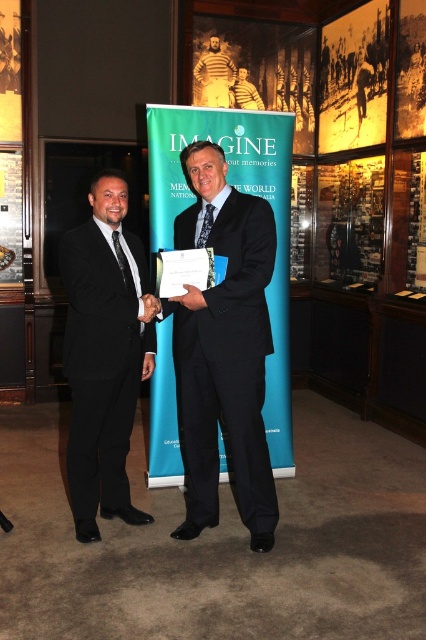
Does black suit at left have a smaller size compared to striped knit sweater at center?

No, black suit at left is not smaller than striped knit sweater at center.

Is the position of black suit at left less distant than that of striped knit sweater at center?

Yes.

Which is in front, point (117, 356) or point (199, 100)?

Point (117, 356)

This screenshot has height=640, width=426. I want to click on black suit at left, so click(104, 355).

Is point (138, 241) less distant than point (245, 97)?

Yes, point (138, 241) is closer to viewer.

Measure the distance from black suit at left to yellow shirt at center.

They are 3.27 meters apart.

Who is more distant from viewer, (109, 481) or (245, 104)?

Positioned behind is point (245, 104).

At what (x,y) coordinates should I click in order to perform the action: click on black suit at left. Please return your answer as a coordinate pair (x, y). Looking at the image, I should click on (104, 355).

Who is positioned more to the left, black suit at center or white paper at center?

white paper at center

Which is above, black suit at center or white paper at center?

white paper at center is above.

This screenshot has height=640, width=426. I want to click on black suit at center, so click(x=224, y=349).

Image resolution: width=426 pixels, height=640 pixels. Find the location of `black suit at center`. black suit at center is located at coordinates (224, 349).